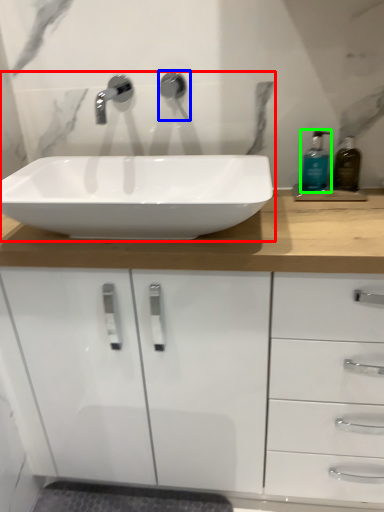
Question: Based on their relative distances, which object is nearer to sink (highlighted by a red box)? Choose from plumbing fixture (highlighted by a blue box) and soap dispenser (highlighted by a green box).

Choices:
 (A) plumbing fixture
 (B) soap dispenser

Answer: (A)